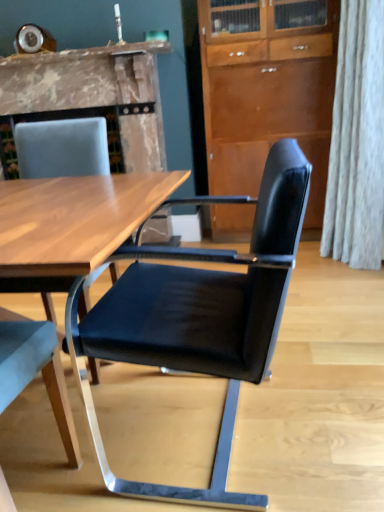
Describe the element at coordinates (94, 93) in the screenshot. I see `marble fireplace at upper left` at that location.

What do you see at coordinates (200, 316) in the screenshot?
I see `black leather chair at center, the first chair viewed from the right` at bounding box center [200, 316].

What is the approximate height of black leather chair at right, acting as the 2th chair starting from the right?

It is 37.22 inches.

Image resolution: width=384 pixels, height=512 pixels. What do you see at coordinates (267, 89) in the screenshot?
I see `wooden cabinet at center` at bounding box center [267, 89].

Locate an element on the screen. Image resolution: width=384 pixels, height=512 pixels. marble fireplace at upper left is located at coordinates (94, 93).

Considering the sizes of marble fireplace at upper left and black leather chair at center, the first chair viewed from the right, in the image, is marble fireplace at upper left taller or shorter than black leather chair at center, the first chair viewed from the right,?

marble fireplace at upper left is shorter than black leather chair at center, the first chair viewed from the right.

Does marble fireplace at upper left contain black leather chair at center, which is the second chair in left-to-right order?

Definitely not — black leather chair at center, which is the second chair in left-to-right order, is not inside marble fireplace at upper left.

Does marble fireplace at upper left turn towards black leather chair at center, which is the second chair in left-to-right order?

Yes, marble fireplace at upper left is oriented towards black leather chair at center, which is the second chair in left-to-right order.

Which is more to the right, marble fireplace at upper left or black leather chair at center, the first chair viewed from the right?

black leather chair at center, the first chair viewed from the right.

Would you say black leather chair at center, which is the second chair in left-to-right order, is to the left or to the right of marble fireplace at upper left in the picture?

Clearly, black leather chair at center, which is the second chair in left-to-right order, is on the right of marble fireplace at upper left in the image.

Which of these two, black leather chair at center, the first chair viewed from the right, or marble fireplace at upper left, is bigger?

marble fireplace at upper left.

How many degrees apart are the facing directions of black leather chair at center, which is the second chair in left-to-right order, and marble fireplace at upper left?

88.4 degrees.

Considering the sizes of objects marble fireplace at upper left and wooden cabinet at center in the image provided, who is thinner, marble fireplace at upper left or wooden cabinet at center?

wooden cabinet at center.

Between marble fireplace at upper left and wooden cabinet at center, which one has larger size?

marble fireplace at upper left is bigger.

From a real-world perspective, is marble fireplace at upper left below wooden cabinet at center?

No, from a real-world perspective, marble fireplace at upper left is not beneath wooden cabinet at center.

Considering the sizes of objects marble fireplace at upper left and wooden cabinet at center in the image provided, who is taller, marble fireplace at upper left or wooden cabinet at center?

wooden cabinet at center.

Is wooden cabinet at center taller or shorter than black leather chair at center, the first chair viewed from the right?

In the image, wooden cabinet at center appears to be taller than black leather chair at center, the first chair viewed from the right.

Is wooden cabinet at center at the right side of black leather chair at center, the first chair viewed from the right?

Yes, wooden cabinet at center is to the right of black leather chair at center, the first chair viewed from the right.

Who is smaller, wooden cabinet at center or black leather chair at center, which is the second chair in left-to-right order?

black leather chair at center, which is the second chair in left-to-right order.

Is black leather chair at right, acting as the 2th chair starting from the right, shorter than marble fireplace at upper left?

No.

Is black leather chair at right, the 1th chair viewed from the left, next to marble fireplace at upper left and touching it?

They are not placed beside each other.

Does black leather chair at right, the 1th chair viewed from the left, have a smaller size compared to marble fireplace at upper left?

A: Yes, black leather chair at right, the 1th chair viewed from the left, is smaller than marble fireplace at upper left.

Is point (71, 463) positioned in front of point (259, 90)?

Yes.

Is black leather chair at right, acting as the 2th chair starting from the right, thinner than wooden cabinet at center?

Indeed, black leather chair at right, acting as the 2th chair starting from the right, has a lesser width compared to wooden cabinet at center.

Is black leather chair at right, acting as the 2th chair starting from the right, bigger than wooden cabinet at center?

No, black leather chair at right, acting as the 2th chair starting from the right, is not bigger than wooden cabinet at center.

From the image's perspective, is black leather chair at right, the 1th chair viewed from the left, positioned above or below wooden cabinet at center?

Based on their image positions, black leather chair at right, the 1th chair viewed from the left, is located beneath wooden cabinet at center.

From a real-world perspective, is wooden cabinet at center over marble fireplace at upper left?

No, from a real-world perspective, wooden cabinet at center is not on top of marble fireplace at upper left.

From the image's perspective, is wooden cabinet at center under marble fireplace at upper left?

Correct, wooden cabinet at center appears lower than marble fireplace at upper left in the image.

You are a GUI agent. You are given a task and a screenshot of the screen. Output one action in this format:
    pyautogui.click(x=<x>, y=<y>)
    Task: Click on the chair that is the 2nd one when counting rightward from the marble fireplace at upper left
    
    Given the screenshot: What is the action you would take?
    pyautogui.click(x=200, y=316)

This screenshot has width=384, height=512. In the image, there is a black leather chair at center, which is the second chair in left-to-right order. What are the coordinates of `fireplace above it (from the image's perspective)` in the screenshot? It's located at (94, 93).

Looking at the image, which one is located closer to black leather chair at center, the first chair viewed from the right, wooden cabinet at center or black leather chair at right, acting as the 2th chair starting from the right?

The object closer to black leather chair at center, the first chair viewed from the right, is black leather chair at right, acting as the 2th chair starting from the right.

Estimate the real-world distances between objects in this image. Which object is further from marble fireplace at upper left, black leather chair at right, acting as the 2th chair starting from the right, or black leather chair at center, the first chair viewed from the right?

black leather chair at right, acting as the 2th chair starting from the right, lies further to marble fireplace at upper left than the other object.

Looking at the image, which one is located closer to black leather chair at center, the first chair viewed from the right, marble fireplace at upper left or wooden cabinet at center?

Based on the image, wooden cabinet at center appears to be nearer to black leather chair at center, the first chair viewed from the right.

Estimate the real-world distances between objects in this image. Which object is further from marble fireplace at upper left, black leather chair at center, the first chair viewed from the right, or wooden cabinet at center?

black leather chair at center, the first chair viewed from the right, lies further to marble fireplace at upper left than the other object.

From the image, which object appears to be farther from marble fireplace at upper left, black leather chair at center, which is the second chair in left-to-right order, or black leather chair at right, the 1th chair viewed from the left?

black leather chair at right, the 1th chair viewed from the left.

Based on their spatial positions, is black leather chair at right, the 1th chair viewed from the left, or wooden cabinet at center closer to black leather chair at center, the first chair viewed from the right?

black leather chair at right, the 1th chair viewed from the left, is positioned closer to the anchor black leather chair at center, the first chair viewed from the right.

Which object lies further to the anchor point wooden cabinet at center, marble fireplace at upper left or black leather chair at center, the first chair viewed from the right?

black leather chair at center, the first chair viewed from the right.

Estimate the real-world distances between objects in this image. Which object is closer to black leather chair at right, the 1th chair viewed from the left, wooden cabinet at center or marble fireplace at upper left?

marble fireplace at upper left is positioned closer to the anchor black leather chair at right, the 1th chair viewed from the left.

This screenshot has width=384, height=512. I want to click on chair between black leather chair at right, the 1th chair viewed from the left, and marble fireplace at upper left from front to back, so click(x=200, y=316).

This screenshot has width=384, height=512. I want to click on cabinetry located between black leather chair at center, which is the second chair in left-to-right order, and marble fireplace at upper left in the depth direction, so click(267, 89).

I want to click on cabinetry positioned between black leather chair at right, acting as the 2th chair starting from the right, and marble fireplace at upper left from near to far, so click(x=267, y=89).

Locate an element on the screen. chair located between black leather chair at right, the 1th chair viewed from the left, and wooden cabinet at center in the depth direction is located at coordinates (200, 316).